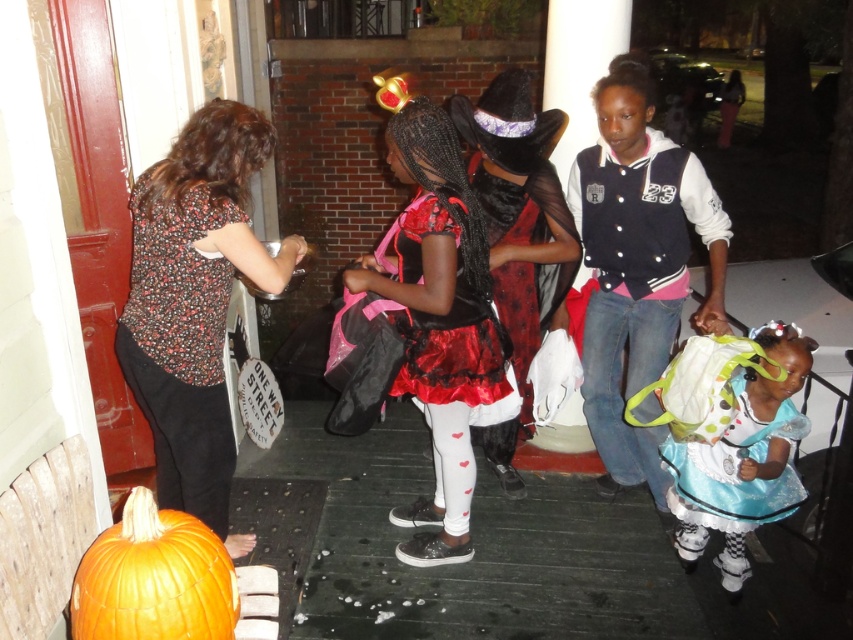
Question: Which of the following is the farthest from the observer?

Choices:
 (A) (758, 480)
 (B) (611, 125)
 (C) (384, 275)

Answer: (A)

Question: Which object is closer to the camera taking this photo?

Choices:
 (A) shiny satin dress at center
 (B) shiny blue dress at lower right
 (C) orange matte pumpkin at lower left
 (D) velvet black jacket at center

Answer: (C)

Question: Is floral blouse at left to the right of shiny satin dress at center from the viewer's perspective?

Choices:
 (A) no
 (B) yes

Answer: (A)

Question: Observing the image, what is the correct spatial positioning of velvet black jacket at center in reference to shiny blue dress at lower right?

Choices:
 (A) right
 (B) left

Answer: (B)

Question: Is floral blouse at left to the right of orange matte pumpkin at lower left from the viewer's perspective?

Choices:
 (A) no
 (B) yes

Answer: (A)

Question: Which point is closer to the camera?

Choices:
 (A) floral blouse at left
 (B) shiny blue dress at lower right

Answer: (A)